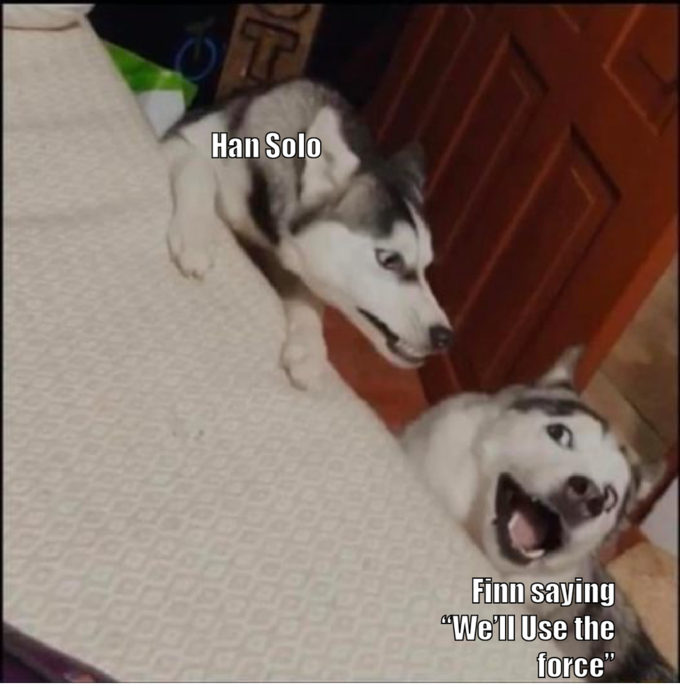
Locate an element on the screen. Image resolution: width=680 pixels, height=688 pixels. bed is located at coordinates (102, 120).